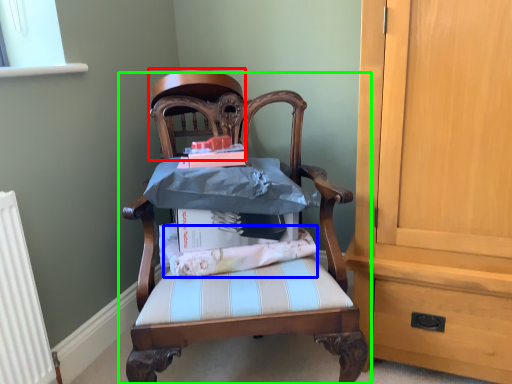
Question: Which is nearer to the chair (highlighted by a red box)? fabric (highlighted by a blue box) or chair (highlighted by a green box).

Choices:
 (A) fabric
 (B) chair

Answer: (B)